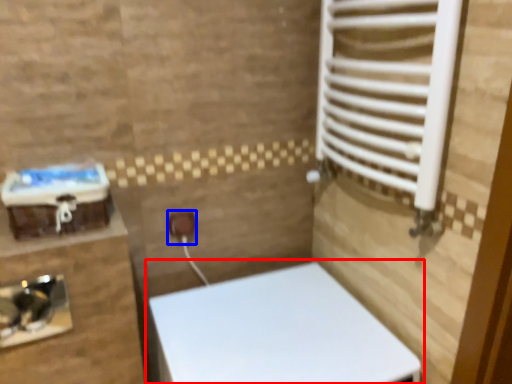
Question: Which object appears closest to the camera in this image, toilet (highlighted by a red box) or electric outlet (highlighted by a blue box)?

Choices:
 (A) toilet
 (B) electric outlet

Answer: (A)